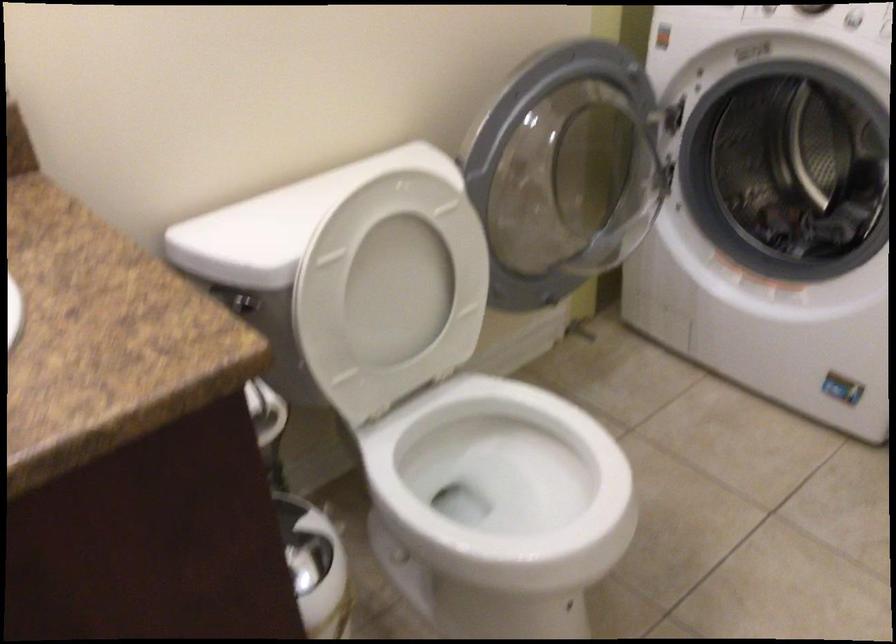
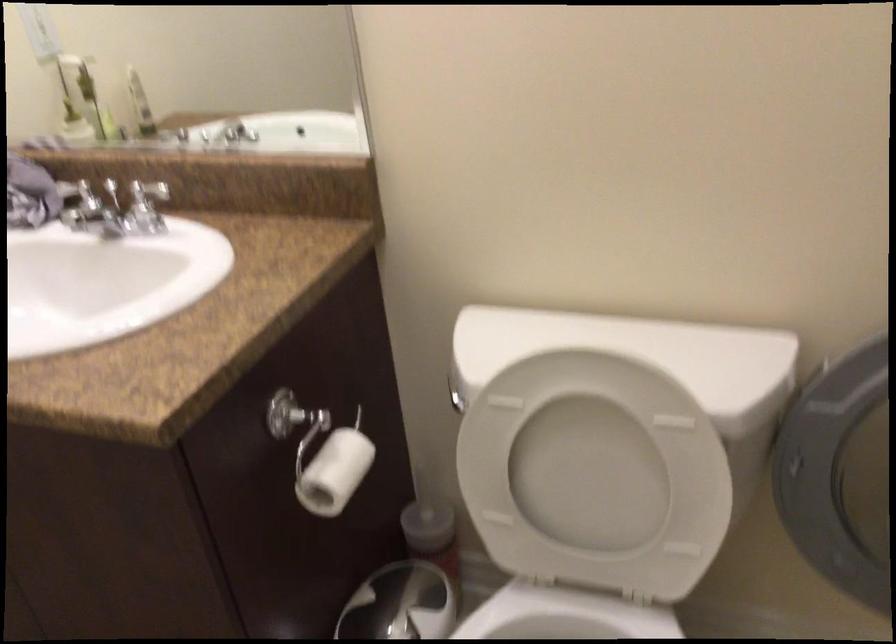
In the second image, find the point that corresponds to the point at 253,399 in the first image.

(334, 471)